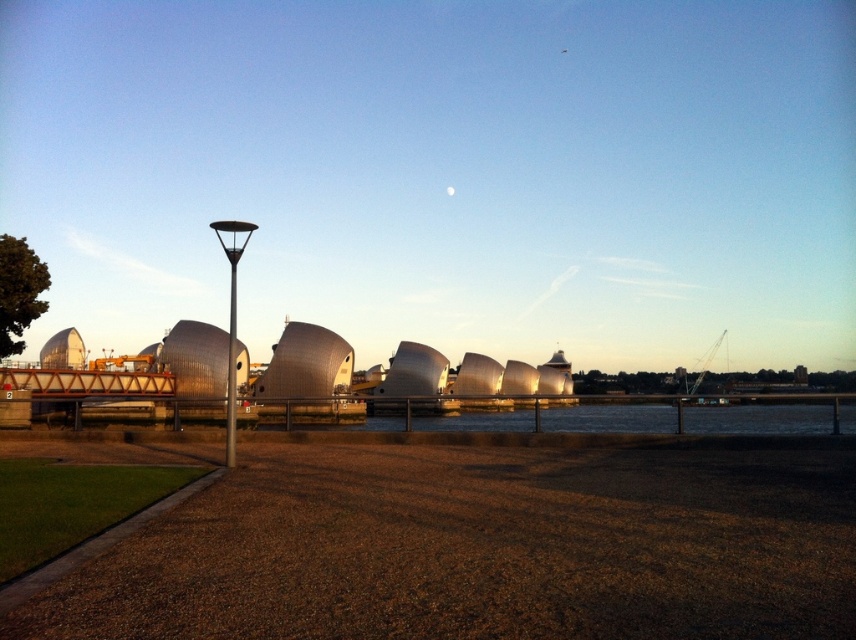
You are a maintenance worker tasked with checking the height of the objects in the riverside scene. Which object is taller between the silver metallic lamp post at left and the metallic pole at left?

The silver metallic lamp post at left is taller than the metallic pole at left.

You are standing at the center of the paved area and want to reach the green grass at lower left. Based on the coordinates provided, in which direction should you walk to get there?

The green grass at lower left is located at coordinates point [94,545], so you should walk towards the lower left direction to reach it.

You are standing at the riverside and want to take a photo of the silver metallic lamp post at left. If your camera has a maximum zoom range of 50 feet, will you be able to capture the lamp post clearly without moving closer?

The silver metallic lamp post at left is 45.90 feet from viewer. Since the camera can zoom up to 50 feet, it is within range. Therefore, you can capture the lamp post clearly without moving closer.